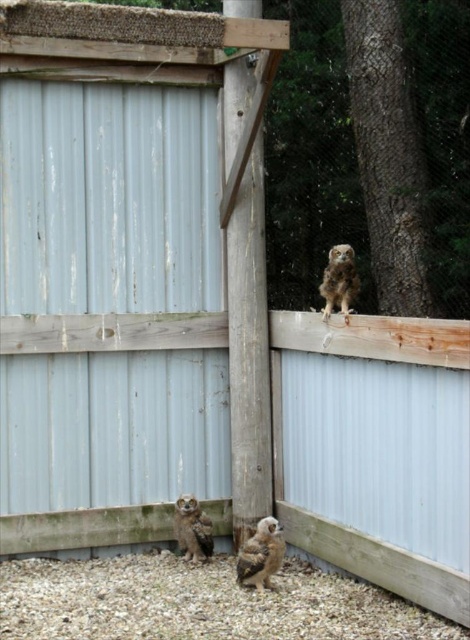
Question: Is brown speckled feathers owl at lower center to the right of brown speckled feathers at upper right from the viewer's perspective?

Choices:
 (A) yes
 (B) no

Answer: (B)

Question: Which object is closer to the camera taking this photo?

Choices:
 (A) brown fuzzy owl at lower center
 (B) brown speckled feathers at upper right
 (C) brown gravel at lower center
 (D) brown speckled feathers owl at lower center

Answer: (C)

Question: Does brown gravel at lower center appear on the left side of brown speckled feathers at upper right?

Choices:
 (A) no
 (B) yes

Answer: (B)

Question: Estimate the real-world distances between objects in this image. Which object is farther from the brown speckled feathers owl at lower center?

Choices:
 (A) brown fuzzy owl at lower center
 (B) brown speckled feathers at upper right

Answer: (B)

Question: Can you confirm if brown gravel at lower center is positioned to the left of brown speckled feathers at upper right?

Choices:
 (A) no
 (B) yes

Answer: (B)

Question: Estimate the real-world distances between objects in this image. Which object is closer to the brown gravel at lower center?

Choices:
 (A) brown speckled feathers at upper right
 (B) brown fuzzy owl at lower center

Answer: (B)